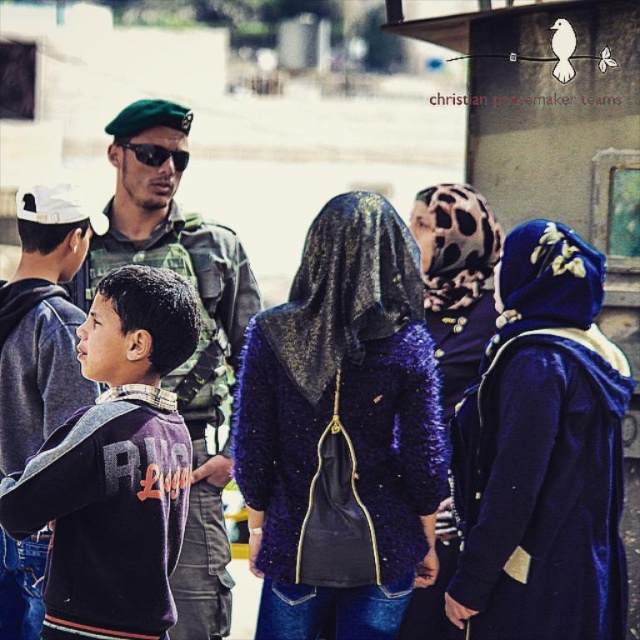
Is green military uniform at center taller than purple sequined jacket at center?

Yes, green military uniform at center is taller than purple sequined jacket at center.

Does green military uniform at center have a smaller size compared to purple sequined jacket at center?

No, green military uniform at center is not smaller than purple sequined jacket at center.

This screenshot has width=640, height=640. What do you see at coordinates (198, 336) in the screenshot?
I see `green military uniform at center` at bounding box center [198, 336].

Find the location of `green military uniform at center`. green military uniform at center is located at coordinates (198, 336).

Is shiny blue jacket at center wider than purple sequined jacket at center?

Yes, shiny blue jacket at center is wider than purple sequined jacket at center.

Which of these two, shiny blue jacket at center or purple sequined jacket at center, stands shorter?

shiny blue jacket at center

Is point (292, 579) less distant than point (458, 220)?

Yes, it is in front of point (458, 220).

You are a GUI agent. You are given a task and a screenshot of the screen. Output one action in this format:
    pyautogui.click(x=<x>, y=<y>)
    Task: Click on the shiny blue jacket at center
    
    Given the screenshot: What is the action you would take?
    pyautogui.click(x=342, y=422)

Can you confirm if purple fleece jacket at lower left is bigger than purple sequined jacket at center?

Incorrect, purple fleece jacket at lower left is not larger than purple sequined jacket at center.

Does point (172, 428) lie in front of point (468, 317)?

Yes, point (172, 428) is in front of point (468, 317).

This screenshot has height=640, width=640. What are the coordinates of `purple fleece jacket at lower left` in the screenshot? It's located at (115, 467).